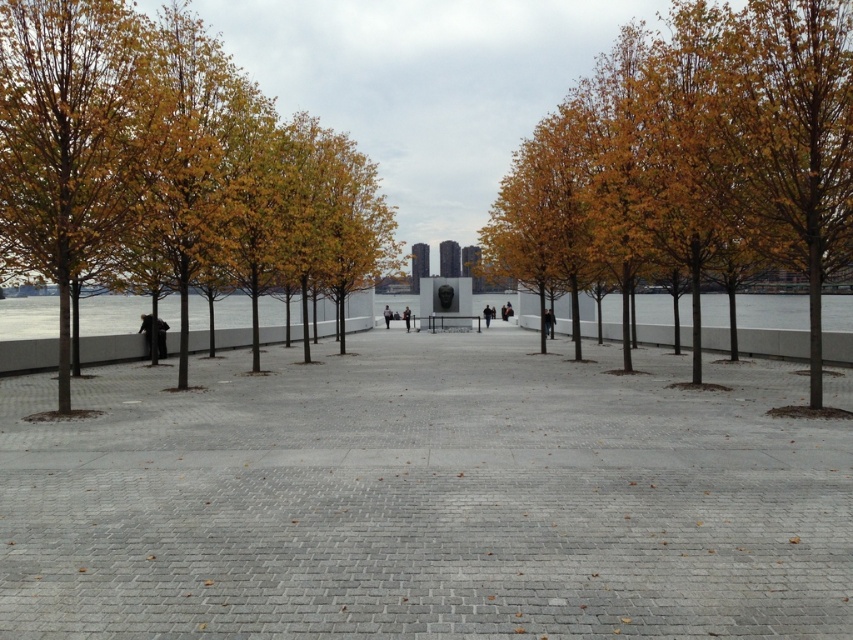
Question: Can you confirm if gray brick pavement at center is wider than dark blue jeans at center?

Choices:
 (A) yes
 (B) no

Answer: (A)

Question: Is golden leafy tree at left in front of black fabric person at center?

Choices:
 (A) yes
 (B) no

Answer: (A)

Question: Which object is positioned farthest from the yellow leaves at center?

Choices:
 (A) dark blue jacket at center
 (B) dark gray fabric jacket at center
 (C) dark blue jeans at center
 (D) golden leafy tree at left

Answer: (B)

Question: Which of the following is the closest to the observer?

Choices:
 (A) (390, 312)
 (B) (180, 470)
 (C) (552, 321)
 (D) (405, 323)

Answer: (B)

Question: Does gray brick pavement at center have a larger size compared to dark blue jacket at center?

Choices:
 (A) no
 (B) yes

Answer: (B)

Question: Estimate the real-world distances between objects in this image. Which object is closer to the dark blue jeans at center?

Choices:
 (A) gray brick pavement at center
 (B) yellow leaves at center
 (C) golden leafy tree at left

Answer: (C)